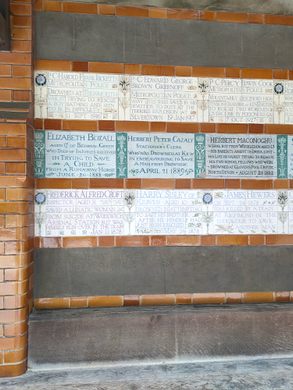
The image size is (293, 390). I want to click on wall, so click(x=191, y=168), click(x=12, y=163), click(x=129, y=275), click(x=151, y=26), click(x=273, y=6).